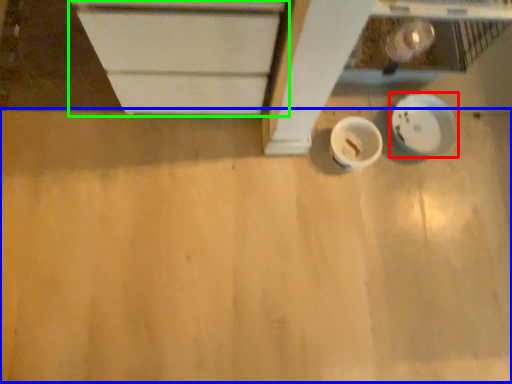
Question: Which object is positioned closest to plate (highlighted by a red box)? Select from plywood (highlighted by a blue box) and cabinetry (highlighted by a green box).

Choices:
 (A) plywood
 (B) cabinetry

Answer: (A)